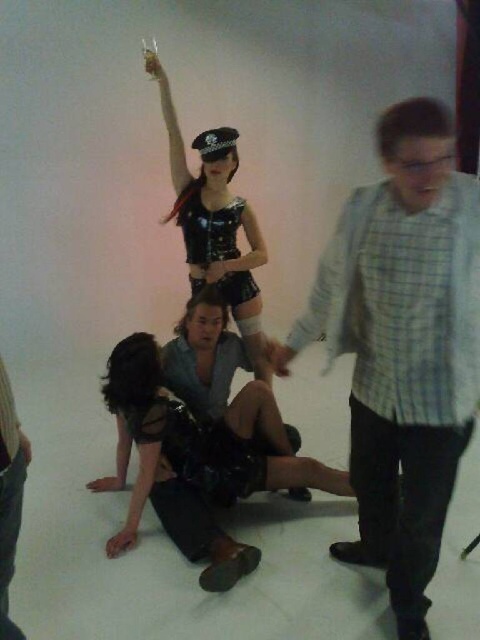
You are organizing a costume party and need to decide which outfit takes up more space when worn. Based on the image, which of the two outfits, the shiny leather vest at center or the leather black dress at center, is wider?

The shiny leather vest at center is wider than the leather black dress at center according to the description.

You are a photographer trying to capture the shiny leather vest at center in the image. Where should you focus your camera to ensure it is centered in your shot?

To center the shiny leather vest at center in your shot, focus your camera on the coordinates point (216, 221).